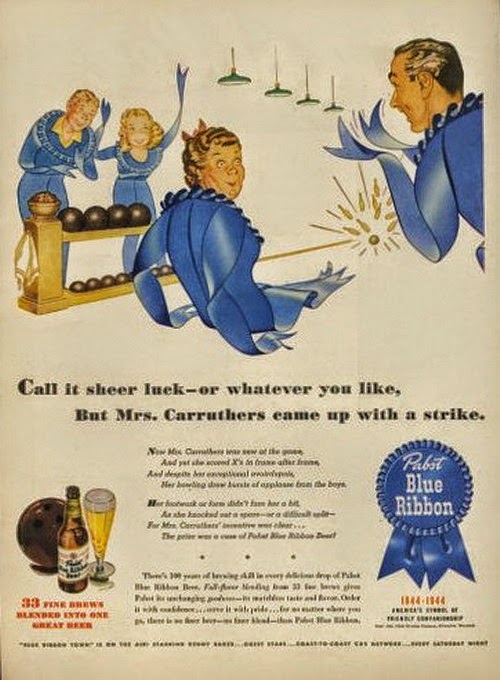
Find the location of a particular element. This screenshot has width=500, height=680. glass is located at coordinates (102, 519).